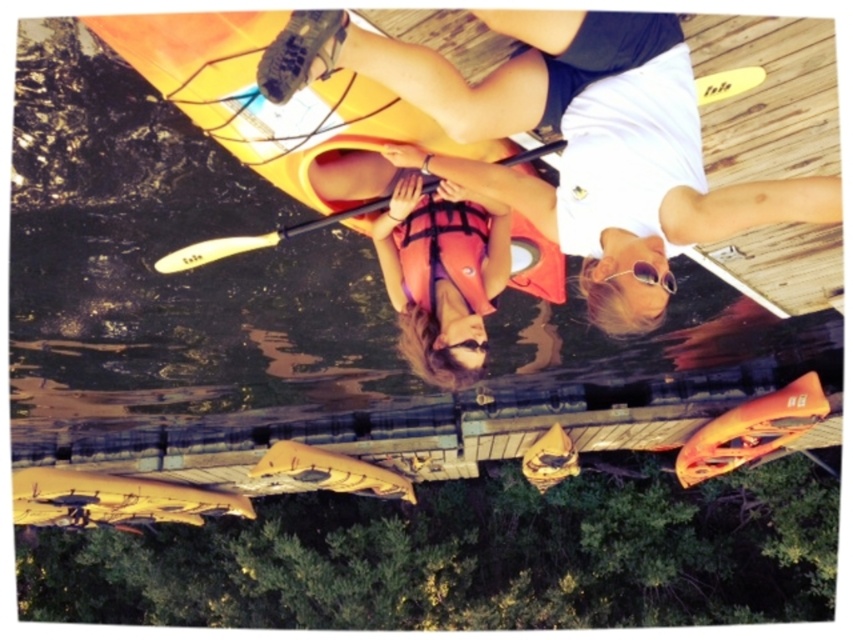
Which is below, wooden smooth paddle at center or white plastic paddle at center?

wooden smooth paddle at center is below.

Between wooden smooth paddle at center and white plastic paddle at center, which one appears on the left side from the viewer's perspective?

wooden smooth paddle at center

Which is in front, point (523, 156) or point (254, 241)?

Point (523, 156) is more forward.

Locate an element on the screen. This screenshot has width=853, height=640. wooden smooth paddle at center is located at coordinates (248, 241).

Which is more to the left, matte orange kayak at upper center or white plastic paddle at center?

white plastic paddle at center

Based on the photo, does matte orange kayak at upper center have a larger size compared to white plastic paddle at center?

Correct, matte orange kayak at upper center is larger in size than white plastic paddle at center.

Who is more forward, (421, 45) or (270, 236)?

Point (421, 45) is in front.

Where is `matte orange kayak at upper center`? matte orange kayak at upper center is located at coordinates (676, 180).

Which is more to the right, matte orange kayak at upper center or orange life vest at center?

matte orange kayak at upper center

Can you confirm if matte orange kayak at upper center is shorter than orange life vest at center?

No.

Is point (613, 284) behind point (480, 244)?

No, it is in front of (480, 244).

Image resolution: width=853 pixels, height=640 pixels. In order to click on matte orange kayak at upper center in this screenshot , I will do `click(676, 180)`.